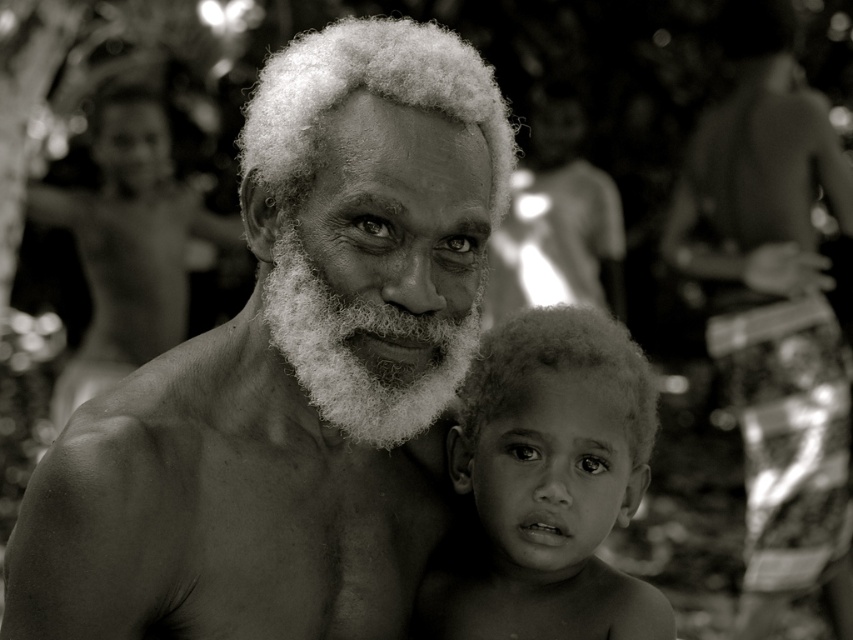
Question: Observing the image, what is the correct spatial positioning of curly hair at center in reference to smooth skin at right?

Choices:
 (A) left
 (B) right

Answer: (A)

Question: Is the position of gray hair man at center less distant than that of curly hair at center?

Choices:
 (A) no
 (B) yes

Answer: (B)

Question: Which point is closer to the camera taking this photo?

Choices:
 (A) (722, 209)
 (B) (297, 449)
 (C) (625, 483)
 (D) (352, 406)

Answer: (D)

Question: Which object is the farthest from the white fluffy beard at center?

Choices:
 (A) smooth skin at right
 (B) curly hair at center
 (C) gray hair man at center

Answer: (A)

Question: Can you confirm if gray hair man at center is positioned below white fluffy beard at center?

Choices:
 (A) yes
 (B) no

Answer: (A)

Question: Which of the following is the farthest from the observer?

Choices:
 (A) smooth skin at right
 (B) curly hair at center
 (C) white fluffy beard at center
 (D) gray hair man at center

Answer: (A)